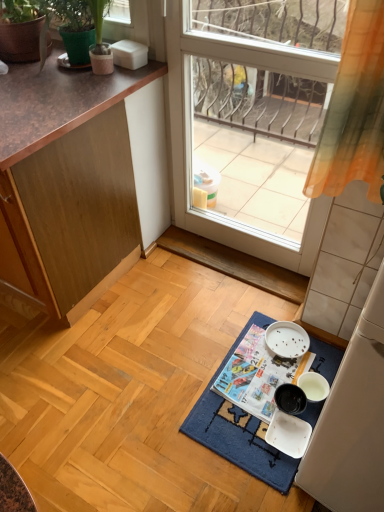
Image resolution: width=384 pixels, height=512 pixels. I want to click on vacant region to the left of blue woven bath mat at center, so click(x=141, y=386).